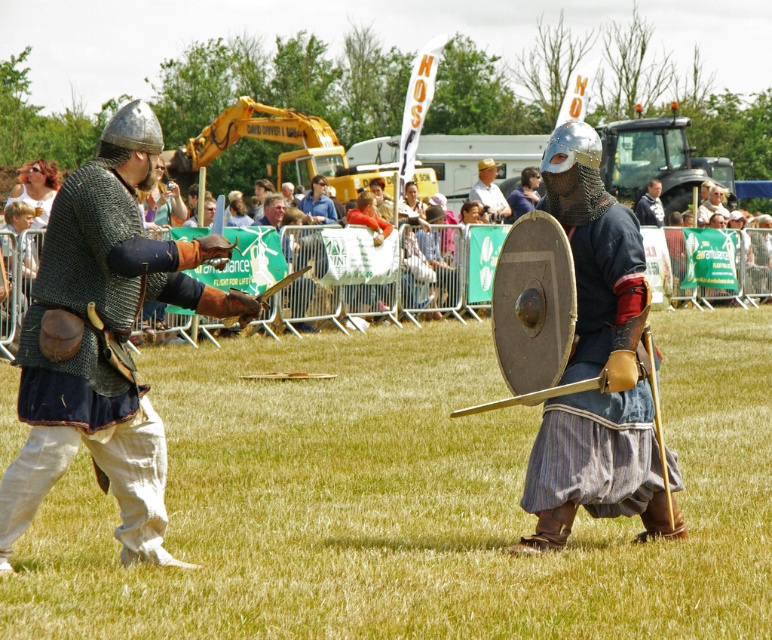
Which is more to the right, matte black sword at center or light brown leather hat at upper center?

light brown leather hat at upper center is more to the right.

I want to click on matte black sword at center, so click(408, 500).

What are the coordinates of `matte black sword at center` in the screenshot? It's located at (408, 500).

Is matte black sword at center to the right of matte silver shield at center from the viewer's perspective?

No, matte black sword at center is not to the right of matte silver shield at center.

Between matte black sword at center and matte silver shield at center, which one is positioned lower?

matte black sword at center is below.

Which is in front, point (412, 616) or point (618, 314)?

Point (412, 616)

In order to click on matte black sword at center in this screenshot , I will do (408, 500).

Who is more forward, (557,220) or (495,164)?

Positioned in front is point (557,220).

Between matte silver shield at center and light brown leather hat at upper center, which one appears on the left side from the viewer's perspective?

From the viewer's perspective, matte silver shield at center appears more on the left side.

Between point (601, 186) and point (486, 204), which one is positioned in front?

Point (601, 186) is more forward.

The width and height of the screenshot is (772, 640). Find the location of `matte silver shield at center`. matte silver shield at center is located at coordinates (598, 365).